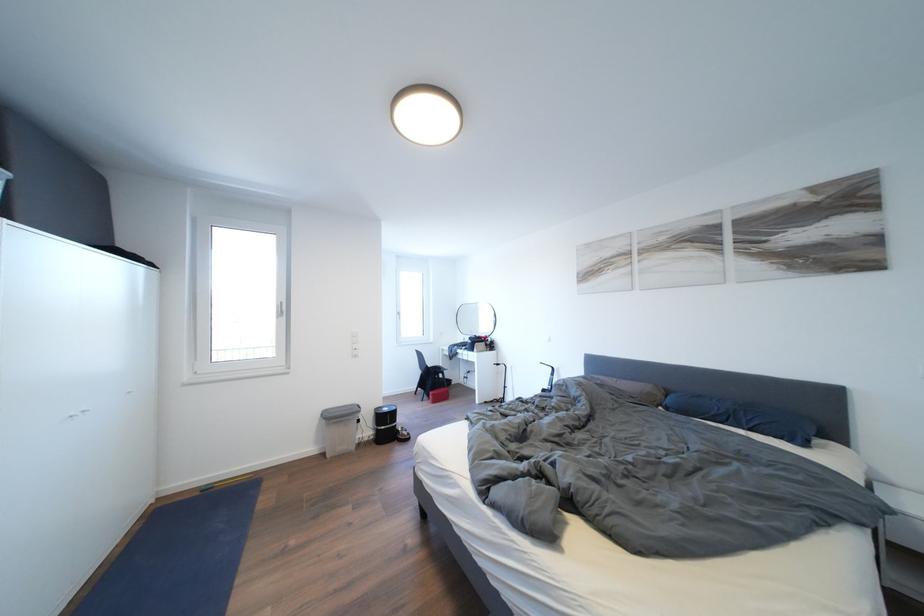
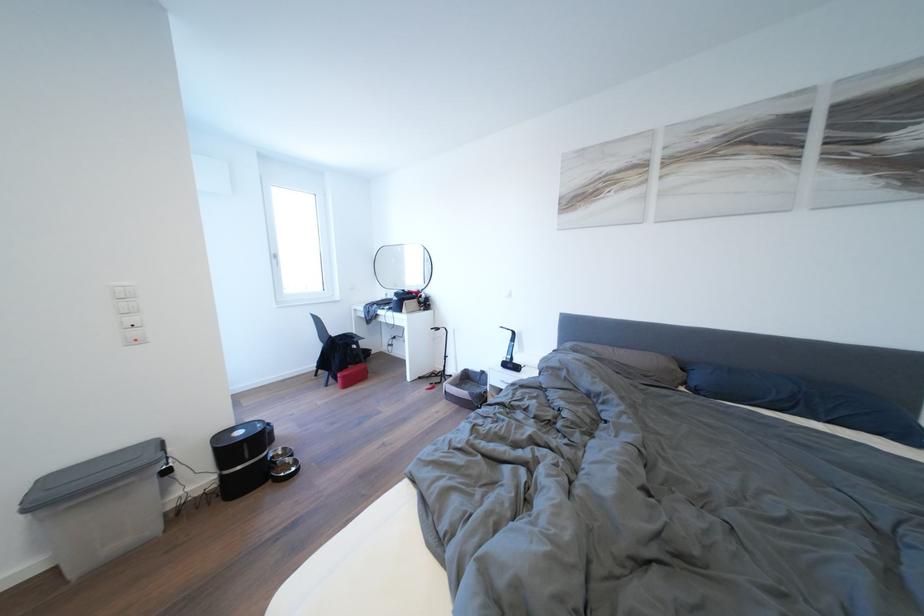
Find the pixel in the second image that matches point (407, 318) in the first image.

(284, 261)